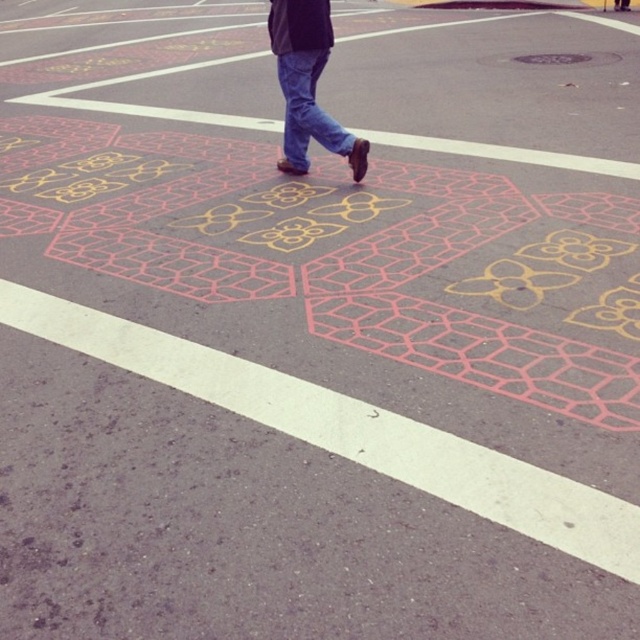
Question: Which point appears closest to the camera in this image?

Choices:
 (A) (280, 74)
 (B) (289, 84)

Answer: (B)

Question: Is blue jeans at center below blue denim jeans at center?

Choices:
 (A) yes
 (B) no

Answer: (B)

Question: Which point is closer to the camera taking this photo?

Choices:
 (A) (300, 173)
 (B) (301, 70)

Answer: (B)

Question: Which point is farther to the camera?

Choices:
 (A) blue jeans at center
 (B) blue denim jeans at center

Answer: (B)

Question: In this image, where is blue jeans at center located relative to blue denim jeans at center?

Choices:
 (A) above
 (B) below

Answer: (A)

Question: Does blue jeans at center have a larger size compared to blue denim jeans at center?

Choices:
 (A) no
 (B) yes

Answer: (B)